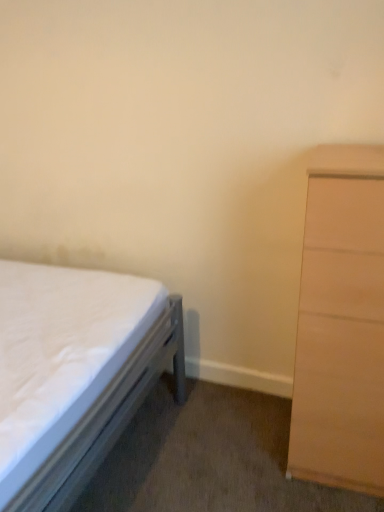
Question: Should I look upward or downward to see white fabric bed at left?

Choices:
 (A) down
 (B) up

Answer: (A)

Question: Considering the relative positions of white fabric bed at left and light brown wood chest of drawers at right in the image provided, is white fabric bed at left to the right of light brown wood chest of drawers at right from the viewer's perspective?

Choices:
 (A) yes
 (B) no

Answer: (B)

Question: Could you tell me if white fabric bed at left is facing light brown wood chest of drawers at right?

Choices:
 (A) no
 (B) yes

Answer: (B)

Question: Is white fabric bed at left behind light brown wood chest of drawers at right?

Choices:
 (A) yes
 (B) no

Answer: (B)

Question: Considering the relative sizes of white fabric bed at left and light brown wood chest of drawers at right in the image provided, is white fabric bed at left thinner than light brown wood chest of drawers at right?

Choices:
 (A) no
 (B) yes

Answer: (A)

Question: Is white fabric bed at left positioned with its back to light brown wood chest of drawers at right?

Choices:
 (A) no
 (B) yes

Answer: (A)

Question: Does white fabric bed at left have a greater width compared to light brown wood chest of drawers at right?

Choices:
 (A) yes
 (B) no

Answer: (A)

Question: Is light brown wood chest of drawers at right located outside white fabric bed at left?

Choices:
 (A) no
 (B) yes

Answer: (B)

Question: Is light brown wood chest of drawers at right aimed at white fabric bed at left?

Choices:
 (A) yes
 (B) no

Answer: (B)

Question: Is light brown wood chest of drawers at right to the right of white fabric bed at left from the viewer's perspective?

Choices:
 (A) no
 (B) yes

Answer: (B)

Question: Is the depth of light brown wood chest of drawers at right greater than that of white fabric bed at left?

Choices:
 (A) yes
 (B) no

Answer: (A)

Question: Does light brown wood chest of drawers at right have a greater height compared to white fabric bed at left?

Choices:
 (A) yes
 (B) no

Answer: (A)

Question: Considering the relative sizes of light brown wood chest of drawers at right and white fabric bed at left in the image provided, is light brown wood chest of drawers at right thinner than white fabric bed at left?

Choices:
 (A) yes
 (B) no

Answer: (A)

Question: Based on their sizes in the image, would you say light brown wood chest of drawers at right is bigger or smaller than white fabric bed at left?

Choices:
 (A) small
 (B) big

Answer: (A)